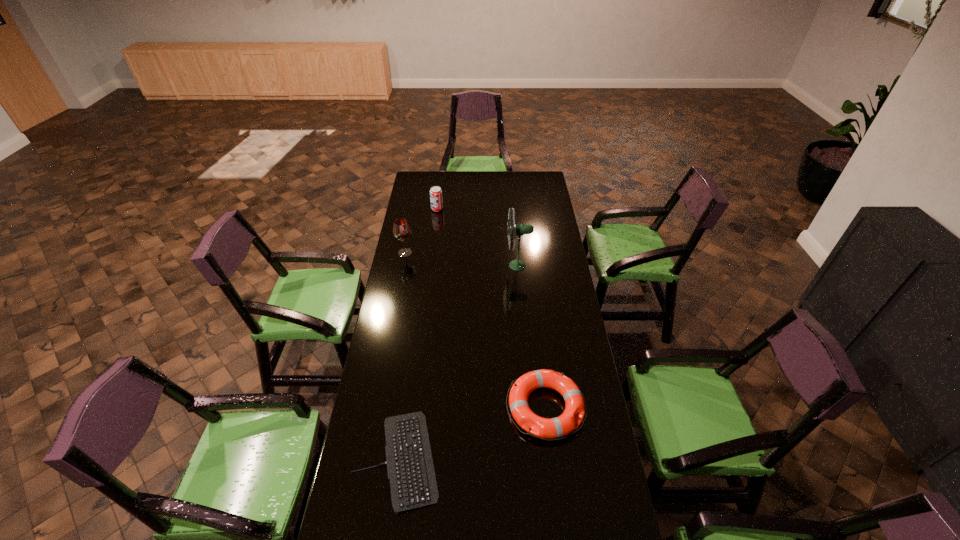
Identify the location of fan. (520, 229).

The image size is (960, 540). I want to click on the fourth shortest object, so click(x=401, y=230).

You are a GUI agent. You are given a task and a screenshot of the screen. Output one action in this format:
    pyautogui.click(x=<x>, y=<y>)
    Task: Click on the third tallest object
    The width and height of the screenshot is (960, 540).
    Given the screenshot: What is the action you would take?
    pyautogui.click(x=436, y=200)

This screenshot has width=960, height=540. Identify the location of the farthest object. (436, 200).

The height and width of the screenshot is (540, 960). I want to click on life buoy, so click(x=544, y=428).

Locate an element on the screen. computer keyboard is located at coordinates (410, 468).

Find the location of a particular element. Image resolution: width=960 pixels, height=540 pixels. vacant space located 0.200m on the front-facing side of the fan is located at coordinates (466, 266).

Locate an element on the screen. The width and height of the screenshot is (960, 540). free point located on the front-facing side of the fan is located at coordinates (493, 266).

Locate an element on the screen. The image size is (960, 540). free region located 0.060m on the front-facing side of the fan is located at coordinates (493, 266).

Identify the location of free location located on the back of the second tallest object. Image resolution: width=960 pixels, height=540 pixels. (411, 224).